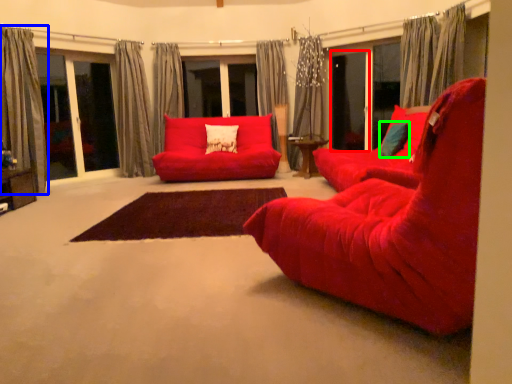
Question: Considering the real-world distances, which object is farthest from screen door (highlighted by a red box)? curtain (highlighted by a blue box) or pillow (highlighted by a green box)?

Choices:
 (A) curtain
 (B) pillow

Answer: (A)